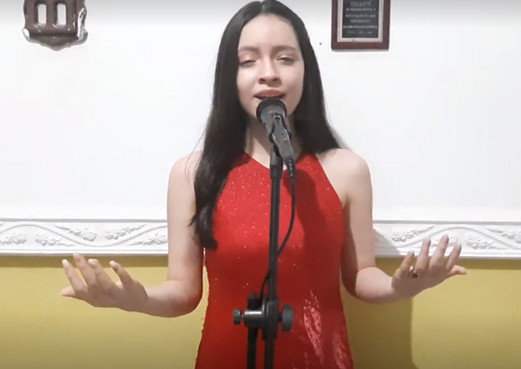
Where is `part of plaque that attaches to wall`? This screenshot has width=521, height=369. part of plaque that attaches to wall is located at coordinates (333, 29).